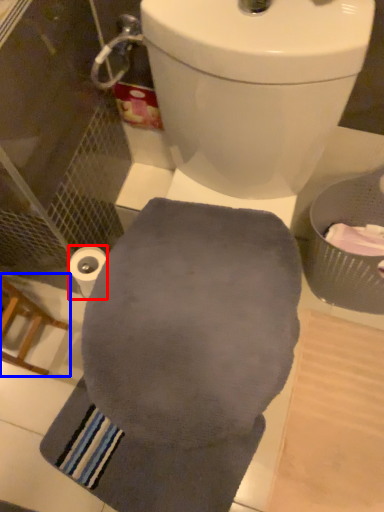
Question: Which object appears farthest to the camera in this image, toilet paper (highlighted by a red box) or chair (highlighted by a blue box)?

Choices:
 (A) toilet paper
 (B) chair

Answer: (A)